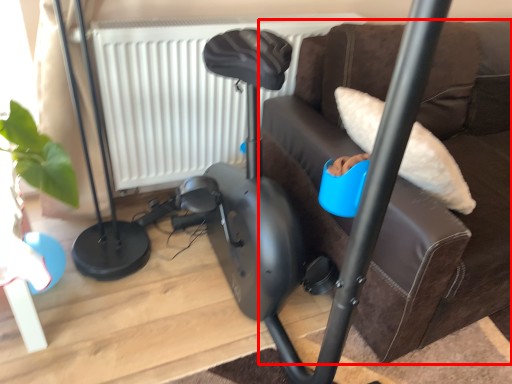
Question: From the image, what is the correct spatial relationship of furniture (annotated by the red box) in relation to radiator?

Choices:
 (A) left
 (B) right

Answer: (B)